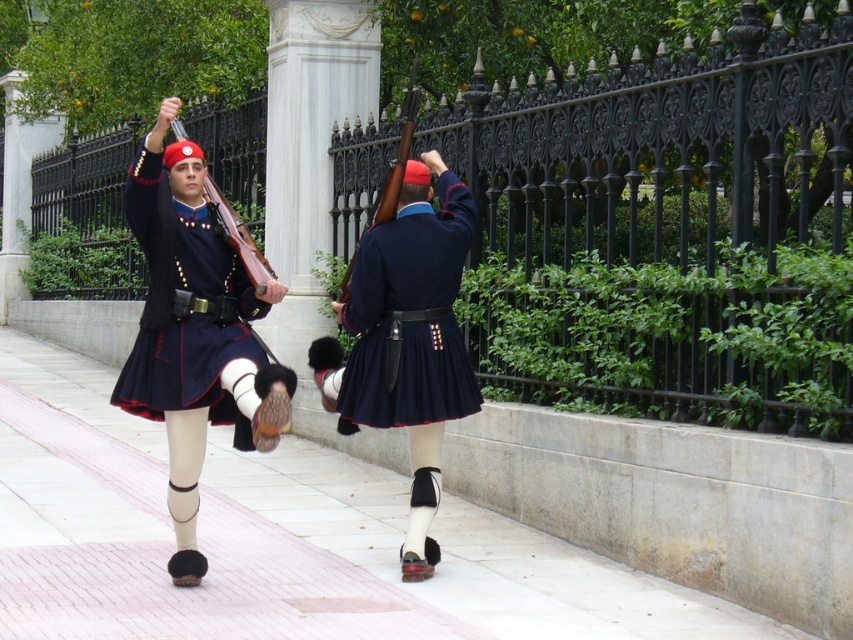
The width and height of the screenshot is (853, 640). Describe the element at coordinates (277, 540) in the screenshot. I see `pink brick pavement at lower center` at that location.

Between pink brick pavement at lower center and wooden rifle at center, which one is positioned higher?

Positioned higher is wooden rifle at center.

Which is behind, point (273, 518) or point (355, 246)?

The point (355, 246) is behind.

Find the location of a particular element. pink brick pavement at lower center is located at coordinates (277, 540).

Is wooden rifle at center thinner than matte wood rifle at upper center?

Indeed, wooden rifle at center has a lesser width compared to matte wood rifle at upper center.

Is point (346, 298) positioned after point (207, 196)?

Yes, it is behind point (207, 196).

Where is `wooden rifle at center`? wooden rifle at center is located at coordinates (398, 152).

You are a GUI agent. You are given a task and a screenshot of the screen. Output one action in this format:
    pyautogui.click(x=<x>, y=<y>)
    Task: Click on the wooden rifle at center
    
    Given the screenshot: What is the action you would take?
    pyautogui.click(x=398, y=152)

Which is more to the right, pink brick pavement at lower center or matte wood rifle at upper center?

Positioned to the right is matte wood rifle at upper center.

Does pink brick pavement at lower center have a greater width compared to matte wood rifle at upper center?

Yes.

Locate an element on the screen. Image resolution: width=853 pixels, height=640 pixels. pink brick pavement at lower center is located at coordinates (277, 540).